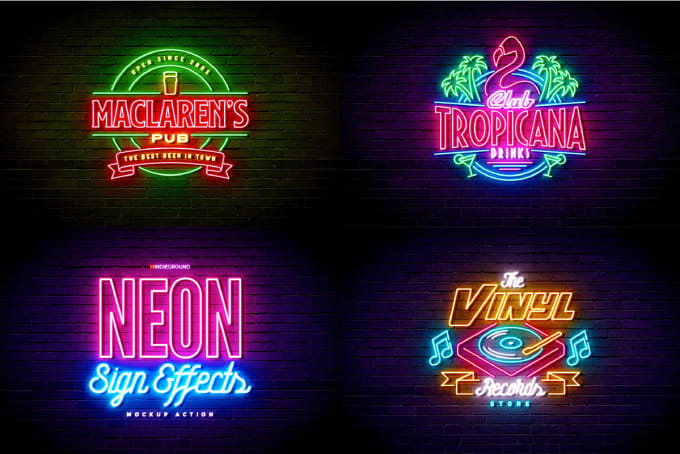
You are a GUI agent. You are given a task and a screenshot of the screen. Output one action in this format:
    pyautogui.click(x=<x>, y=<y>)
    Task: Click on the neon sign effects sign
    
    Given the screenshot: What is the action you would take?
    pyautogui.click(x=192, y=342)